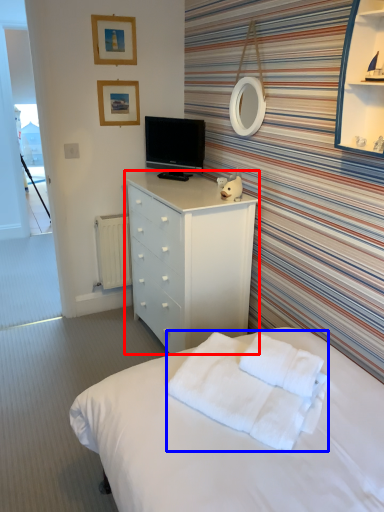
Question: Which point is further to the camera, chest of drawers (highlighted by a red box) or blanket (highlighted by a blue box)?

Choices:
 (A) chest of drawers
 (B) blanket

Answer: (A)